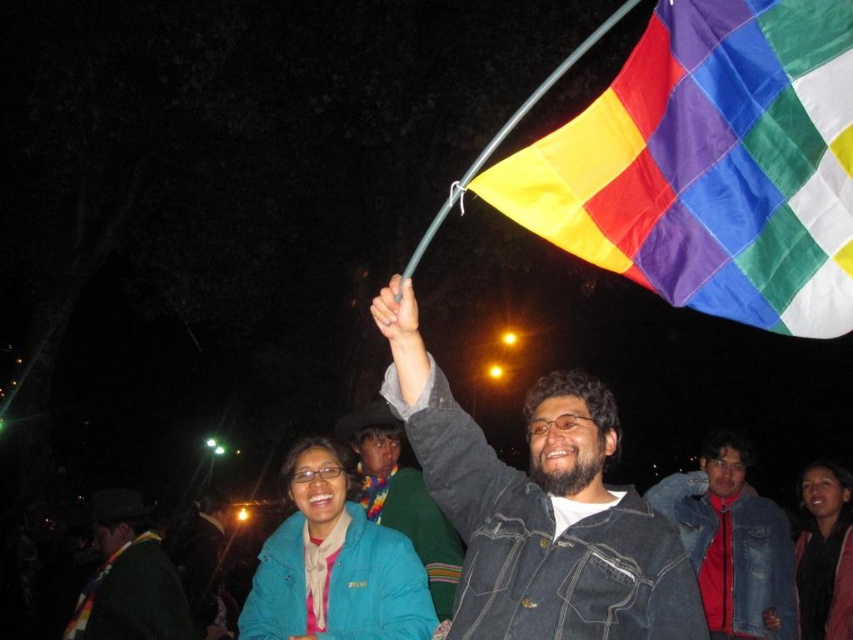
Question: Is green wool scarf at lower left positioned before blue fleece jacket at lower right?

Choices:
 (A) yes
 (B) no

Answer: (A)

Question: Can you confirm if matte teal jacket at lower center is smaller than green wool scarf at lower left?

Choices:
 (A) no
 (B) yes

Answer: (B)

Question: Which of the following is the farthest from the observer?

Choices:
 (A) (100, 600)
 (B) (219, 540)
 (C) (741, 628)

Answer: (B)

Question: Which point is farther to the camera?

Choices:
 (A) green wool scarf at lower left
 (B) polyester rainbow flag at upper right
 (C) denim jacket at center

Answer: (A)

Question: Is denim jacket at upper center above denim jacket at center?

Choices:
 (A) no
 (B) yes

Answer: (B)

Question: Which point is closer to the camera?

Choices:
 (A) (387, 566)
 (B) (381, 451)
 (C) (836, 588)

Answer: (A)